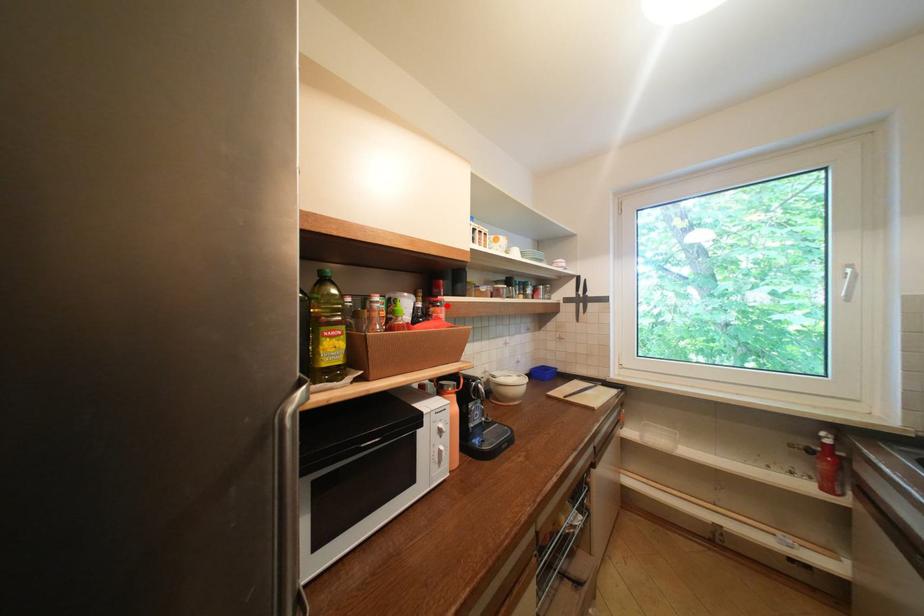
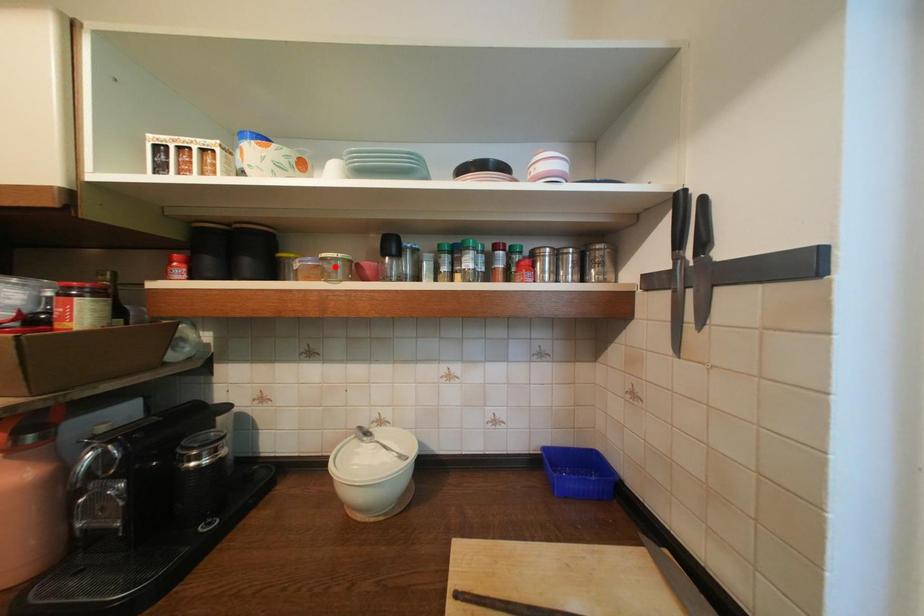
I am providing you with two images of the same scene from different viewpoints. A red point is marked on the first image and another point is marked on the second image. Do the highlighted points in image1 and image2 indicate the same real-world spot?

No